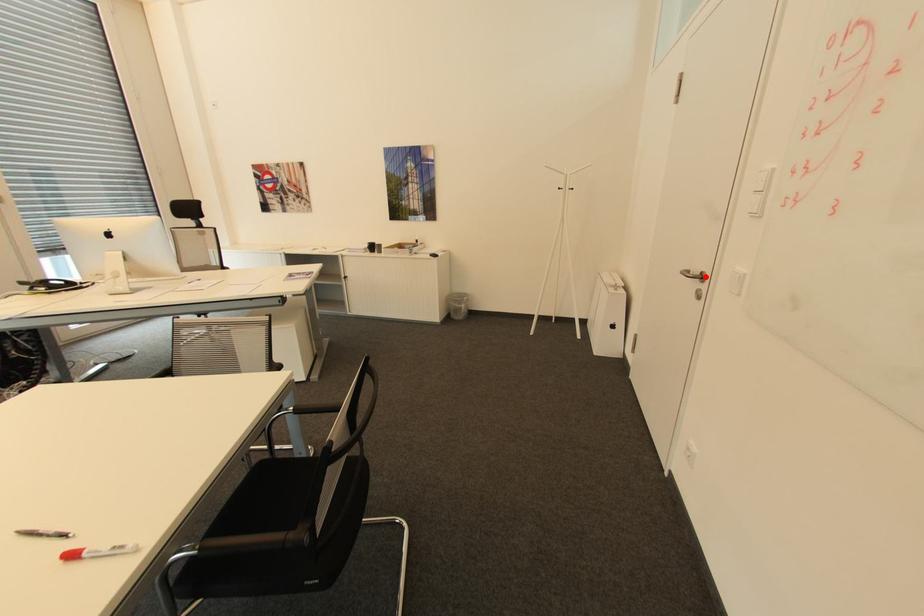
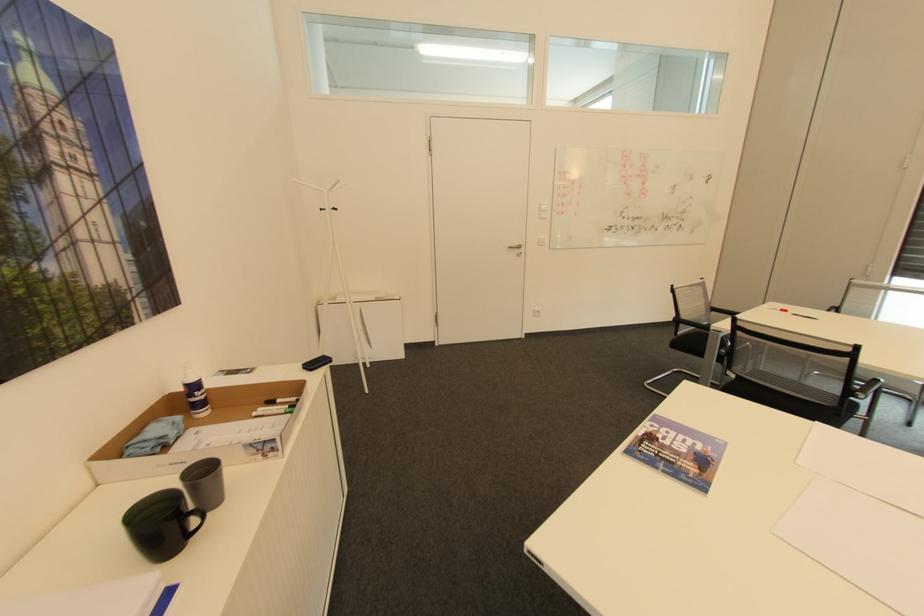
Question: I am providing you with two images of the same scene from different viewpoints. Given a red point in image1, look at the same physical point in image2. Is it:

Choices:
 (A) Closer to the viewpoint
 (B) Farther from the viewpoint

Answer: (A)